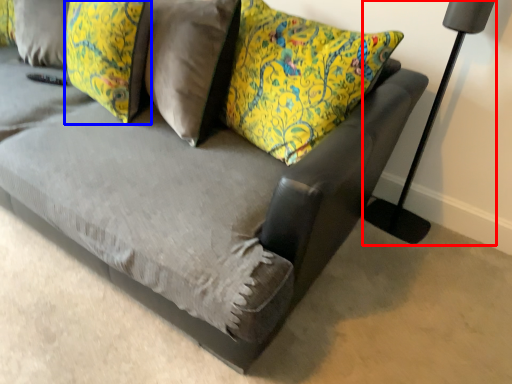
Question: Which point is closer to the camera, table lamp (highlighted by a red box) or pillow (highlighted by a blue box)?

Choices:
 (A) table lamp
 (B) pillow

Answer: (A)